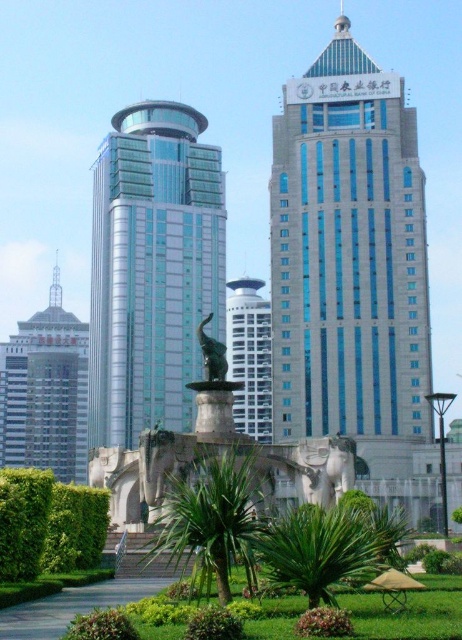
You are a drone operator trying to fly a drone from the green leafy hedge at lower left to the white glossy tower at center. Considering their heights, will the drone have to ascend or descend during its flight path?

The green leafy hedge at lower left has a lesser height compared to the white glossy tower at center, so the drone will have to ascend during its flight path to reach the white glossy tower at center.

You are standing at the camera position and want to take a photo of the green glass building at center. If your camera has a maximum focus range of 120 meters, will it be able to capture the building clearly?

The distance between the green glass building at center and the camera is 122.80 meters, which exceeds the camera maximum focus range of 120 meters. Therefore, the camera cannot capture the building clearly.

You are standing at the base of the shorter building and want to walk directly towards the taller building. There are two points marked on the ground in front of you. One is at point coordinates point (30, 492) and the other is at point coordinates point (243, 316). Which point will you reach first as you walk towards the taller building?

Since point (30, 492) is in front of point (243, 316), you will reach point (30, 492) first as you walk towards the taller building.